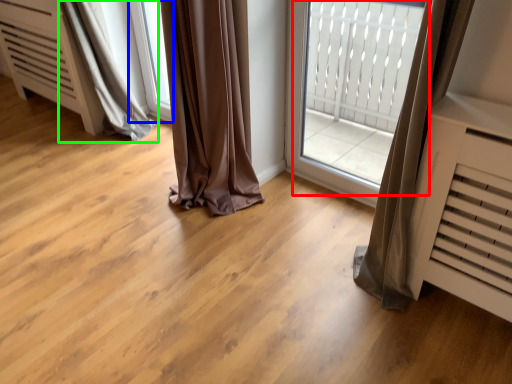
Question: Which is farther away from bay window (highlighted by a red box)? window (highlighted by a blue box) or curtain (highlighted by a green box)?

Choices:
 (A) window
 (B) curtain

Answer: (B)